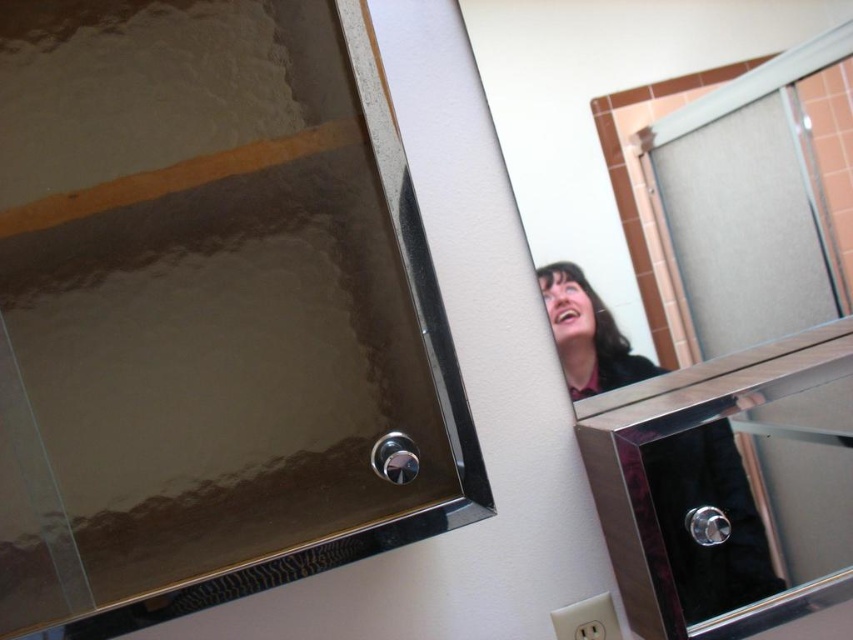
Is point (374, 426) positioned behind point (685, 464)?

No, it is not.

Can you confirm if glossy metallic mirror at upper center is thinner than shiny silver mirror at upper right?

In fact, glossy metallic mirror at upper center might be wider than shiny silver mirror at upper right.

This screenshot has width=853, height=640. In order to click on glossy metallic mirror at upper center in this screenshot , I will do `click(209, 312)`.

Is glossy metallic mirror at upper center behind polished chrome mirror at upper right?

→ No, it is in front of polished chrome mirror at upper right.

Can you confirm if glossy metallic mirror at upper center is positioned above polished chrome mirror at upper right?

Incorrect, glossy metallic mirror at upper center is not positioned above polished chrome mirror at upper right.

Who is more forward, [195,481] or [827,20]?

Point [195,481] is in front.

I want to click on glossy metallic mirror at upper center, so click(209, 312).

Is polished chrome mirror at upper right behind shiny silver mirror at upper right?

Yes, it is.

Describe the element at coordinates (602, 93) in the screenshot. The height and width of the screenshot is (640, 853). I see `polished chrome mirror at upper right` at that location.

I want to click on polished chrome mirror at upper right, so click(x=602, y=93).